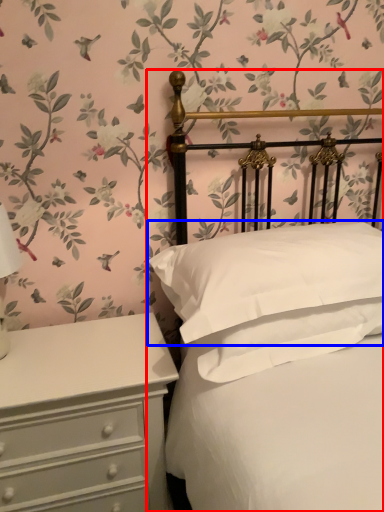
Question: Among these objects, which one is farthest to the camera, bed (highlighted by a red box) or pillow (highlighted by a blue box)?

Choices:
 (A) bed
 (B) pillow

Answer: (B)